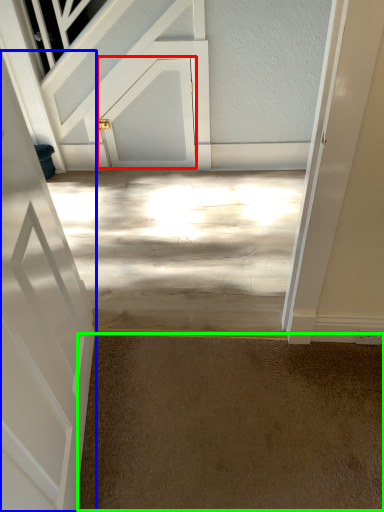
Question: Which is nearer to the door (highlighted by a red box)? door (highlighted by a blue box) or concrete (highlighted by a green box).

Choices:
 (A) door
 (B) concrete

Answer: (A)